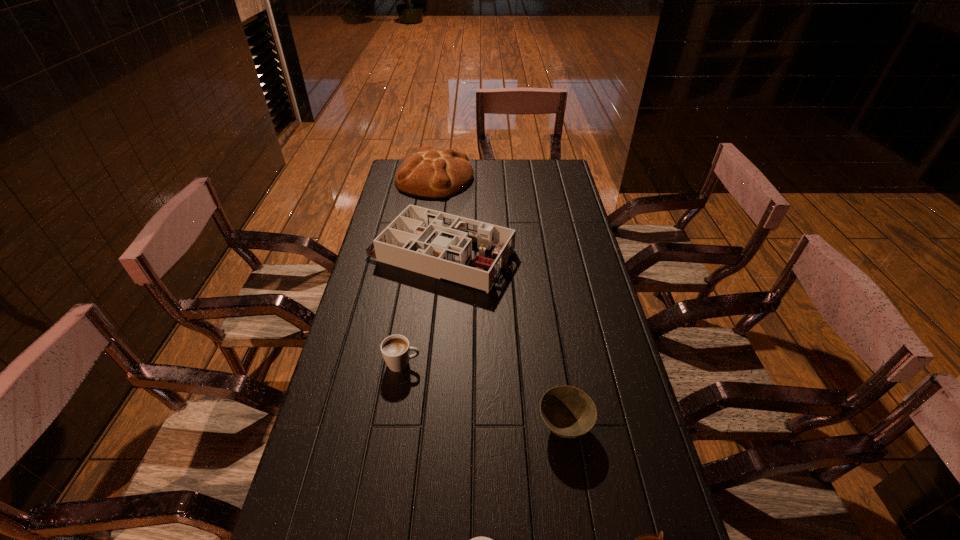
Where is `vacant space situated 0.220m on the back of the bowl`? This screenshot has height=540, width=960. vacant space situated 0.220m on the back of the bowl is located at coordinates (551, 336).

You are a GUI agent. You are given a task and a screenshot of the screen. Output one action in this format:
    pyautogui.click(x=<x>, y=<y>)
    Task: Click on the object that is at the far edge
    The height and width of the screenshot is (540, 960).
    Given the screenshot: What is the action you would take?
    pyautogui.click(x=429, y=173)

This screenshot has height=540, width=960. In order to click on bread that is at the left edge in this screenshot , I will do `click(429, 173)`.

The height and width of the screenshot is (540, 960). What are the coordinates of `dollhouse present at the left edge` in the screenshot? It's located at (437, 244).

Identify the location of cappuccino that is positioned at the left edge. (395, 349).

In order to click on object located at the right edge in this screenshot , I will do `click(568, 412)`.

Locate an element on the screen. Image resolution: width=960 pixels, height=540 pixels. object positioned at the far left corner is located at coordinates (429, 173).

The image size is (960, 540). In the image, there is a desktop. Identify the location of free space at the left edge. (316, 430).

Find the location of a particular element. The height and width of the screenshot is (540, 960). vacant space at the right edge of the desktop is located at coordinates (596, 325).

I want to click on free space at the far left corner of the desktop, so click(394, 180).